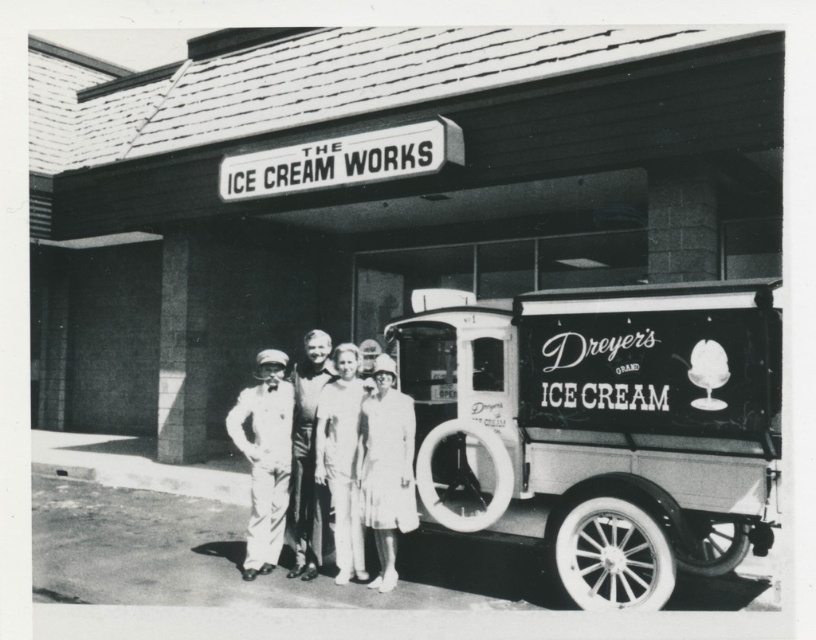
Is smooth concrete wall at center smaller than white cotton dress at center?

No, smooth concrete wall at center is not smaller than white cotton dress at center.

The image size is (816, 640). What do you see at coordinates (380, 198) in the screenshot? I see `smooth concrete wall at center` at bounding box center [380, 198].

The width and height of the screenshot is (816, 640). Find the location of `smooth concrete wall at center`. smooth concrete wall at center is located at coordinates click(380, 198).

Does smooth concrete wall at center appear over light brown leather jacket at center?

Yes, smooth concrete wall at center is above light brown leather jacket at center.

Does point (140, 280) lie in front of point (309, 360)?

No, (140, 280) is further to viewer.

Where is `smooth concrete wall at center`? smooth concrete wall at center is located at coordinates (380, 198).

Can you confirm if light beige cotton dress at center is taller than light brown leather jacket at center?

In fact, light beige cotton dress at center may be shorter than light brown leather jacket at center.

Does light beige cotton dress at center appear on the left side of light brown leather jacket at center?

In fact, light beige cotton dress at center is to the right of light brown leather jacket at center.

In order to click on light beige cotton dress at center in this screenshot , I will do `click(342, 458)`.